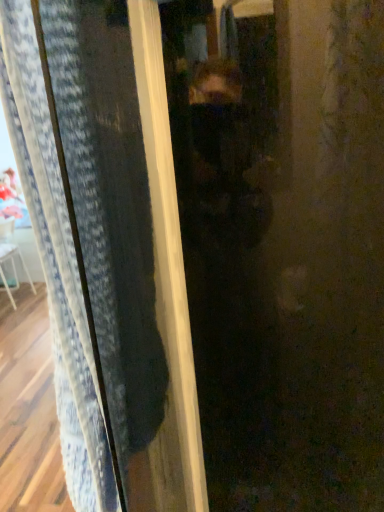
Question: Does transparent plastic screen door at center have a smaller size compared to white fabric armchair at left?

Choices:
 (A) no
 (B) yes

Answer: (B)

Question: Is transparent plastic screen door at center closer to camera compared to white fabric armchair at left?

Choices:
 (A) yes
 (B) no

Answer: (A)

Question: Is transparent plastic screen door at center not inside white fabric armchair at left?

Choices:
 (A) yes
 (B) no

Answer: (A)

Question: Is transparent plastic screen door at center looking in the opposite direction of white fabric armchair at left?

Choices:
 (A) yes
 (B) no

Answer: (B)

Question: From the image's perspective, is transparent plastic screen door at center located beneath white fabric armchair at left?

Choices:
 (A) yes
 (B) no

Answer: (B)

Question: Is transparent plastic screen door at center surrounding white fabric armchair at left?

Choices:
 (A) no
 (B) yes

Answer: (A)

Question: Does white fabric armchair at left turn towards transparent plastic screen door at center?

Choices:
 (A) yes
 (B) no

Answer: (B)

Question: Is the position of white fabric armchair at left more distant than that of transparent plastic screen door at center?

Choices:
 (A) yes
 (B) no

Answer: (A)

Question: Considering the relative positions of white fabric armchair at left and transparent plastic screen door at center in the image provided, is white fabric armchair at left to the right of transparent plastic screen door at center from the viewer's perspective?

Choices:
 (A) no
 (B) yes

Answer: (A)

Question: From the image's perspective, does white fabric armchair at left appear lower than transparent plastic screen door at center?

Choices:
 (A) no
 (B) yes

Answer: (B)

Question: Does white fabric armchair at left have a greater width compared to transparent plastic screen door at center?

Choices:
 (A) no
 (B) yes

Answer: (B)

Question: Considering the relative sizes of white fabric armchair at left and transparent plastic screen door at center in the image provided, is white fabric armchair at left shorter than transparent plastic screen door at center?

Choices:
 (A) yes
 (B) no

Answer: (B)

Question: Is white fabric armchair at left wider or thinner than transparent plastic screen door at center?

Choices:
 (A) wide
 (B) thin

Answer: (A)